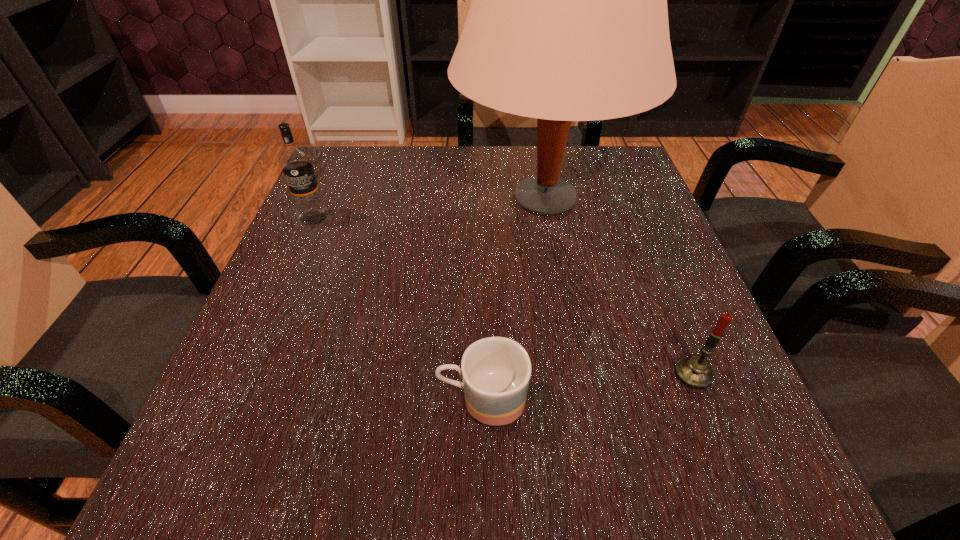
Identify the location of free space between the third shortest object and the candle. (503, 296).

Find the location of a particular element. The width and height of the screenshot is (960, 540). vacant area that lies between the third tallest object and the lampshade is located at coordinates (618, 287).

At what (x,y) coordinates should I click in order to perform the action: click on blank region between the candle and the lampshade. Please return your answer as a coordinate pair (x, y). The image size is (960, 540). Looking at the image, I should click on (618, 287).

What are the coordinates of `free area in between the tallest object and the candle` in the screenshot? It's located at (618, 287).

Find the location of `object that ranks as the closest to the second shortest object`. object that ranks as the closest to the second shortest object is located at coordinates (568, 22).

The image size is (960, 540). I want to click on the third closest object to the shortest object, so click(295, 162).

What are the coordinates of `vacant space that satisfies the following two spatial constraints: 1. on the front-facing side of the lampshade; 2. on the label of the vodka` in the screenshot? It's located at (547, 218).

Locate an element on the screen. Image resolution: width=960 pixels, height=540 pixels. free space that satisfies the following two spatial constraints: 1. on the front-facing side of the tallest object; 2. on the label of the vodka is located at coordinates (547, 218).

You are a GUI agent. You are given a task and a screenshot of the screen. Output one action in this format:
    pyautogui.click(x=<x>, y=<y>)
    Task: Click on the vacant space that satisfies the following two spatial constraints: 1. on the front-facing side of the tallest object; 2. on the label of the second tallest object
    The image size is (960, 540).
    Given the screenshot: What is the action you would take?
    pyautogui.click(x=547, y=218)

This screenshot has width=960, height=540. What are the coordinates of `vacant space that satisfies the following two spatial constraints: 1. on the front-facing side of the tallest object; 2. on the label of the leftmost object` in the screenshot? It's located at (547, 218).